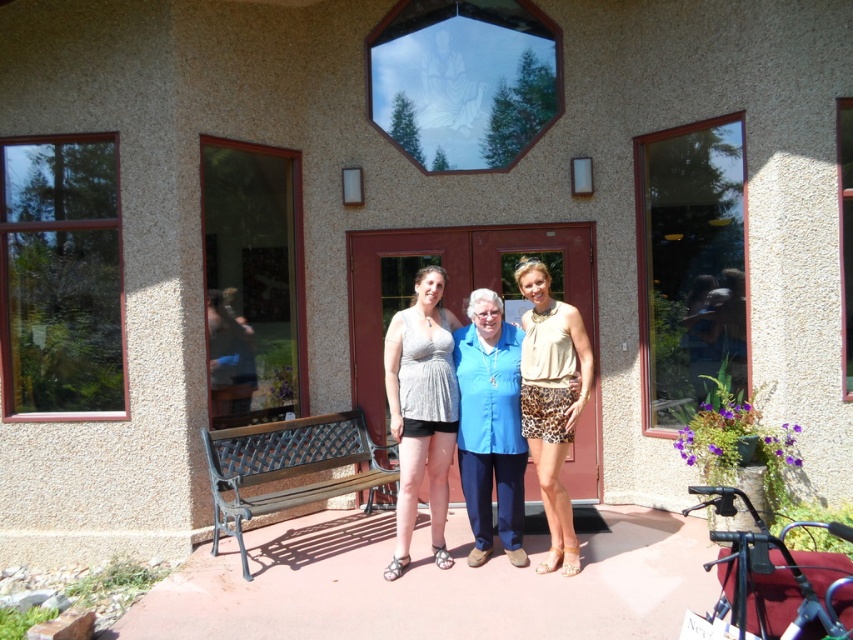
Question: Is shiny silver tank top at center bigger than leopard print shorts at center?

Choices:
 (A) yes
 (B) no

Answer: (A)

Question: Can you confirm if green wrought iron bench at lower left is wider than leopard print shorts at center?

Choices:
 (A) yes
 (B) no

Answer: (A)

Question: Is shiny silver tank top at center further to camera compared to leopard print shorts at center?

Choices:
 (A) no
 (B) yes

Answer: (B)

Question: Which point is farther to the camera?

Choices:
 (A) (384, 372)
 (B) (236, 454)
 (C) (581, 342)

Answer: (A)

Question: Which object is the closest to the shiny silver tank top at center?

Choices:
 (A) leopard print shorts at center
 (B) green wrought iron bench at lower left

Answer: (A)

Question: Considering the real-world distances, which object is closest to the leopard print shorts at center?

Choices:
 (A) green wrought iron bench at lower left
 (B) shiny silver tank top at center

Answer: (B)